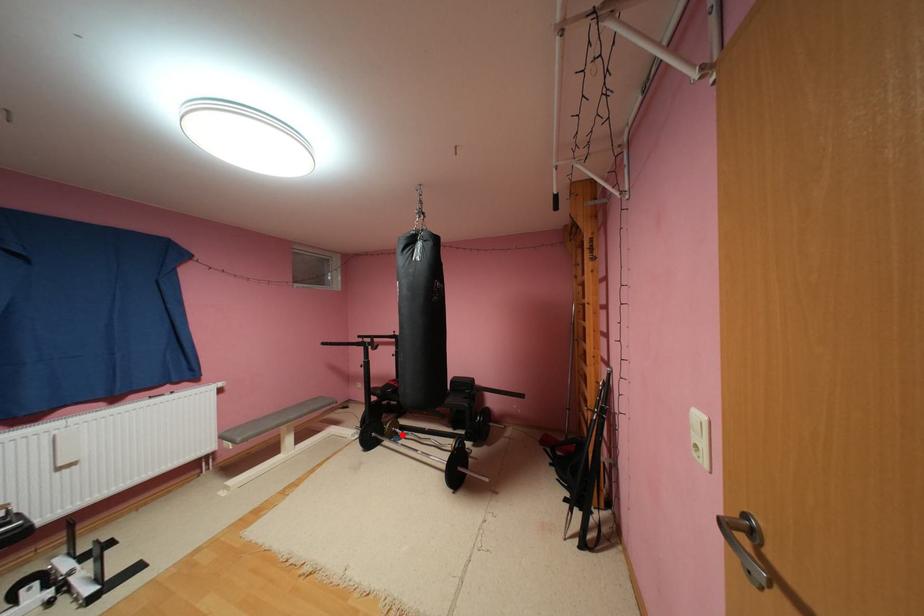
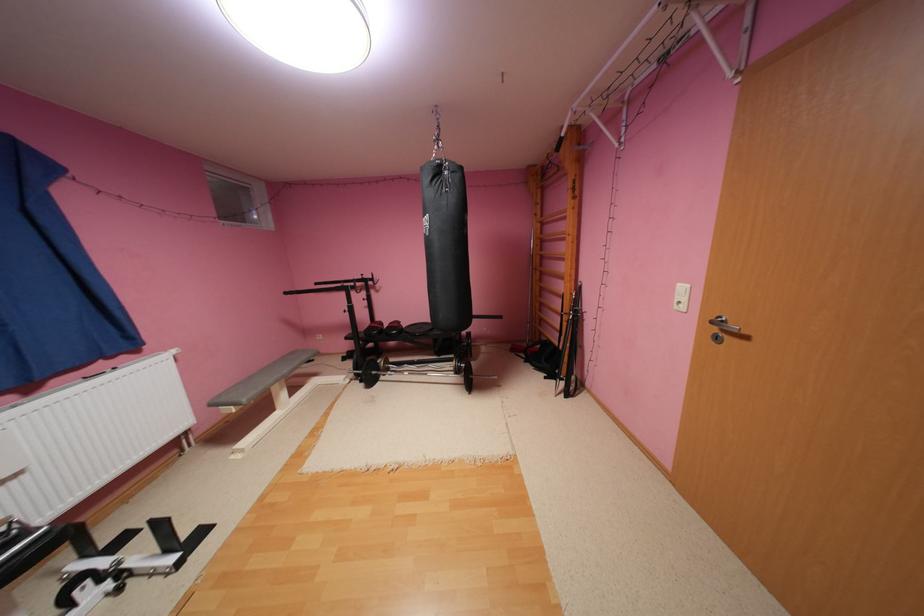
In the second image, find the point that corresponds to the highlighted location in the first image.

(396, 371)